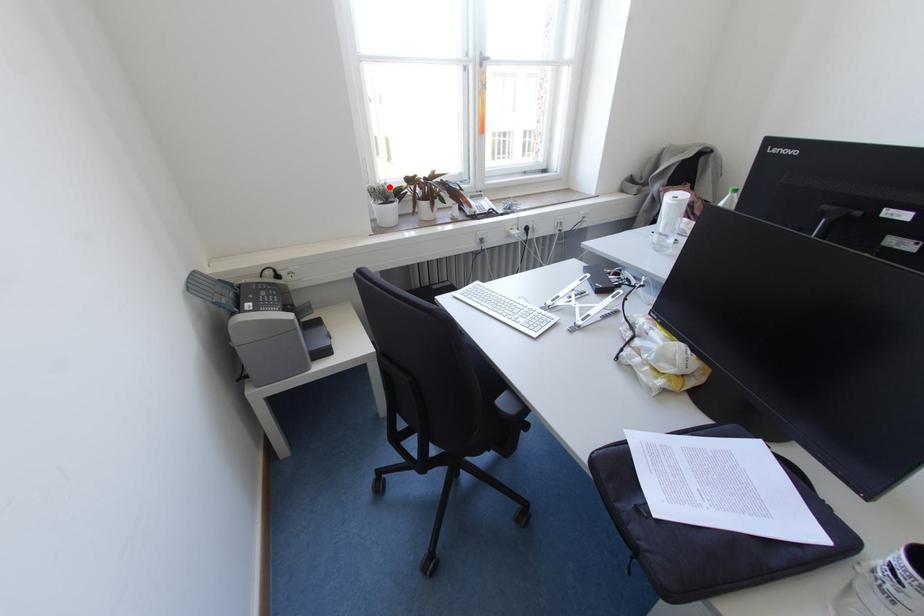
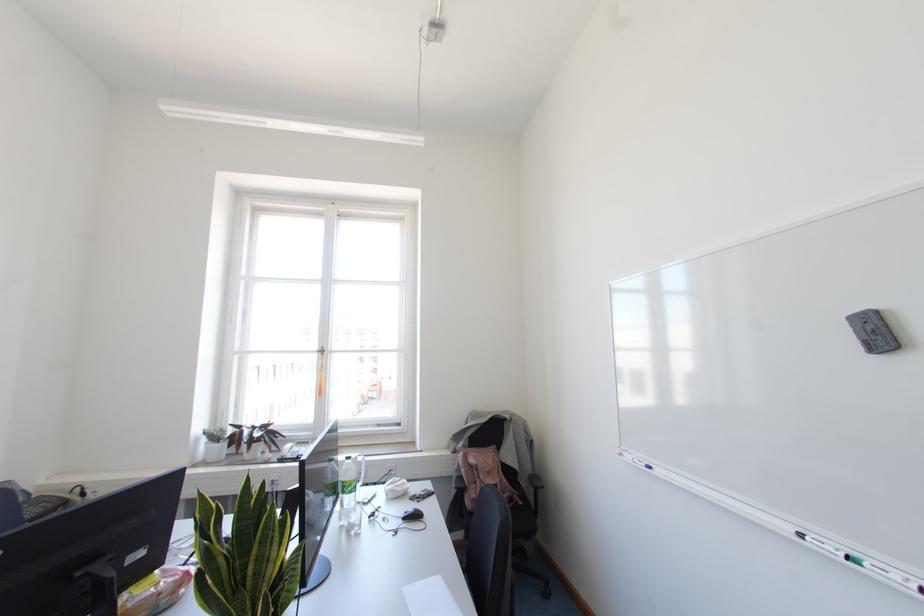
Question: I am providing you with two images of the same scene from different viewpoints. Given a red point in image1, look at the same physical point in image2. Is it:

Choices:
 (A) Closer to the viewpoint
 (B) Farther from the viewpoint

Answer: (B)